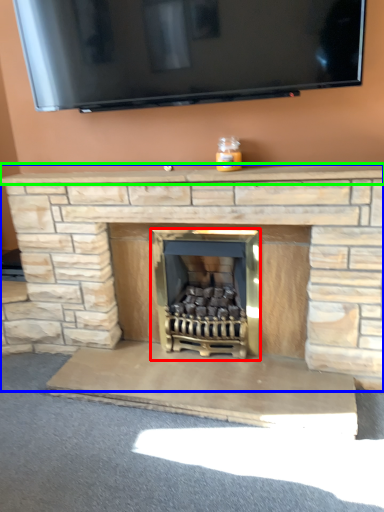
Question: Which is nearer to the wood burning stove (highlighted by a red box)? fireplace (highlighted by a blue box) or mantle (highlighted by a green box).

Choices:
 (A) fireplace
 (B) mantle

Answer: (A)